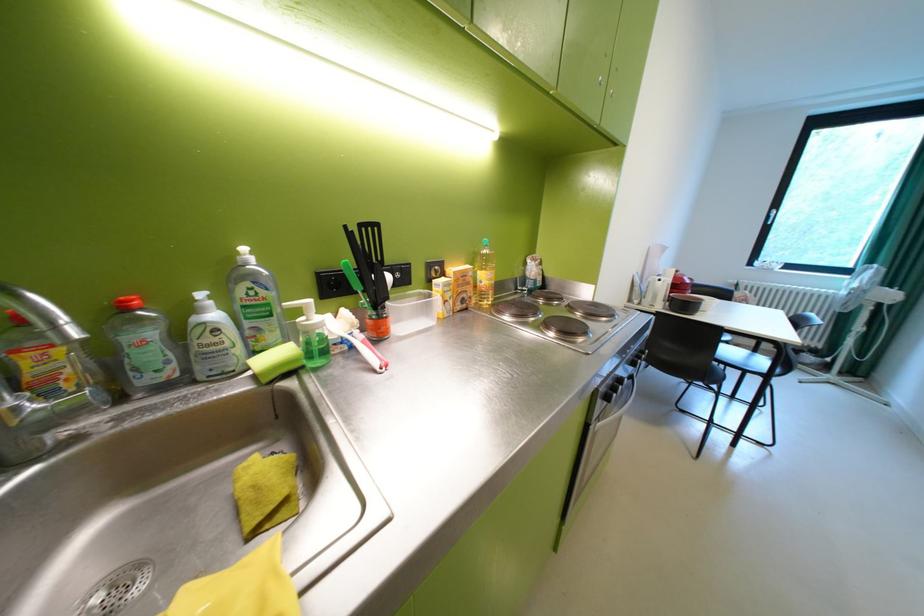
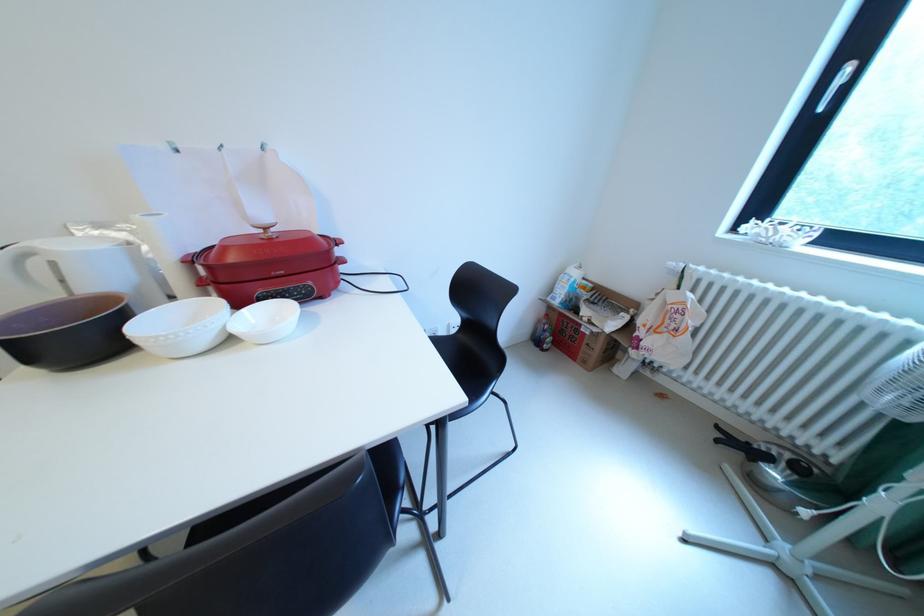
The images are taken continuously from a first-person perspective. In which direction are you moving?

The cameraman moved toward right, forward.